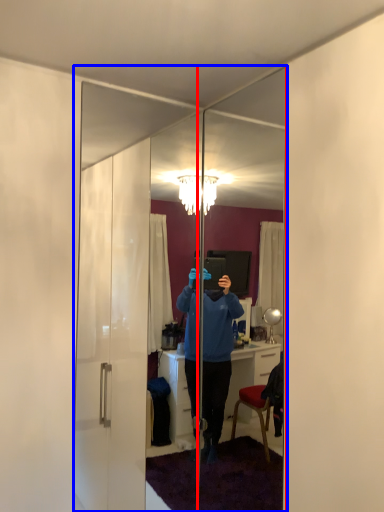
Question: Among these objects, which one is farthest to the camera, mirror (highlighted by a red box) or mirror (highlighted by a blue box)?

Choices:
 (A) mirror
 (B) mirror

Answer: (B)